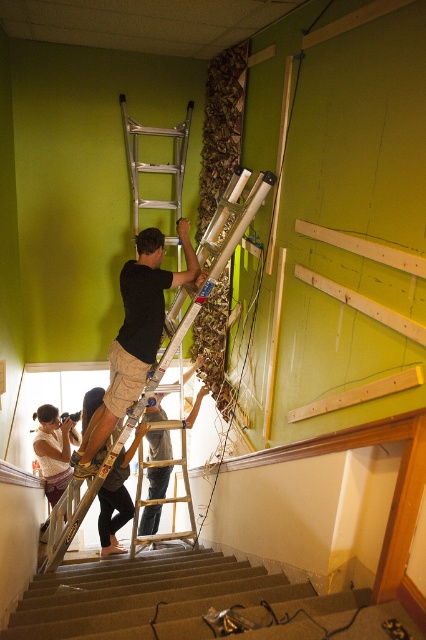
Between silver metallic ladder at center and wooden ladder at center, which one has more height?

With more height is silver metallic ladder at center.

Is silver metallic ladder at center to the left of wooden ladder at center from the viewer's perspective?

Yes, silver metallic ladder at center is to the left of wooden ladder at center.

This screenshot has height=640, width=426. Identify the location of silver metallic ladder at center. (164, 360).

From the picture: Does carpeted stairs at lower left appear over white lace dress at lower left?

No, carpeted stairs at lower left is not above white lace dress at lower left.

Is carpeted stairs at lower left below white lace dress at lower left?

Yes, carpeted stairs at lower left is below white lace dress at lower left.

Between point (190, 628) and point (54, 486), which one is positioned in front?

Point (190, 628)

Locate an element on the screen. The height and width of the screenshot is (640, 426). carpeted stairs at lower left is located at coordinates (161, 596).

Is black cotton shirt at upper center thinner than white lace dress at lower left?

No, black cotton shirt at upper center is not thinner than white lace dress at lower left.

This screenshot has height=640, width=426. I want to click on black cotton shirt at upper center, so click(x=135, y=333).